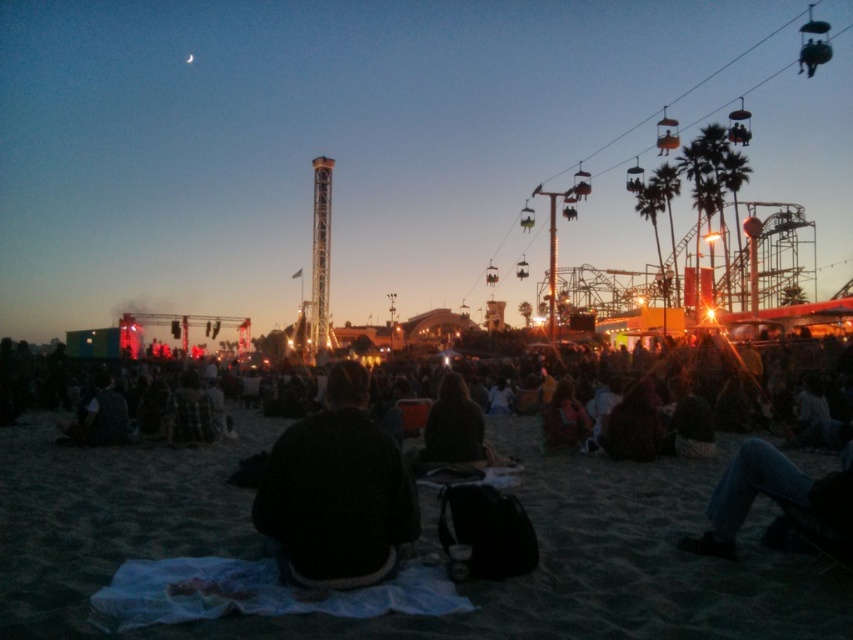
Who is taller, black sweater at center or dark brown sweater at center?

Standing taller between the two is black sweater at center.

Is point (393, 552) positioned before point (440, 385)?

Yes, it is.

Find the location of a particular element. black sweater at center is located at coordinates (335, 492).